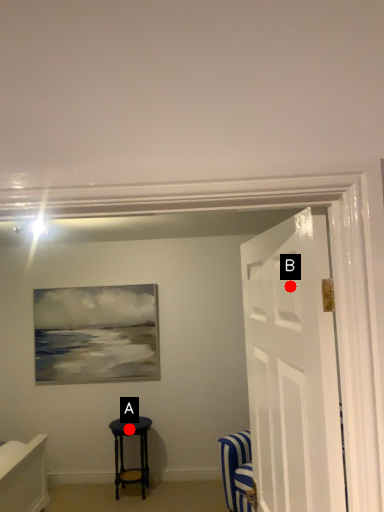
Question: Two points are circled on the image, labeled by A and B beside each circle. Which of the following is the closest to the observer?

Choices:
 (A) A is closer
 (B) B is closer

Answer: (B)